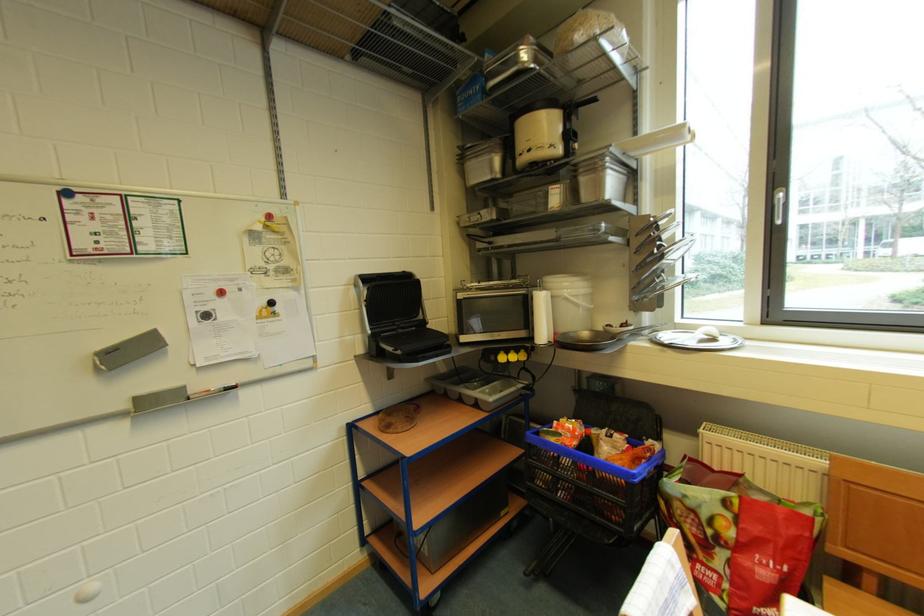
You are a GUI agent. You are given a task and a screenshot of the screen. Output one action in this format:
    pyautogui.click(x=<x>, y=<y>)
    Task: Click on the white window handle
    
    Given the screenshot: What is the action you would take?
    pyautogui.click(x=777, y=205)